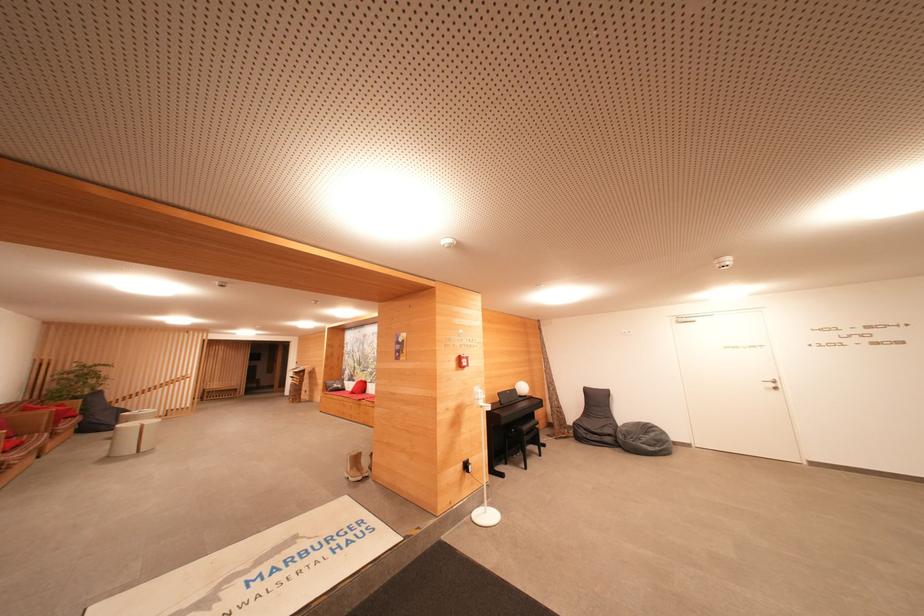
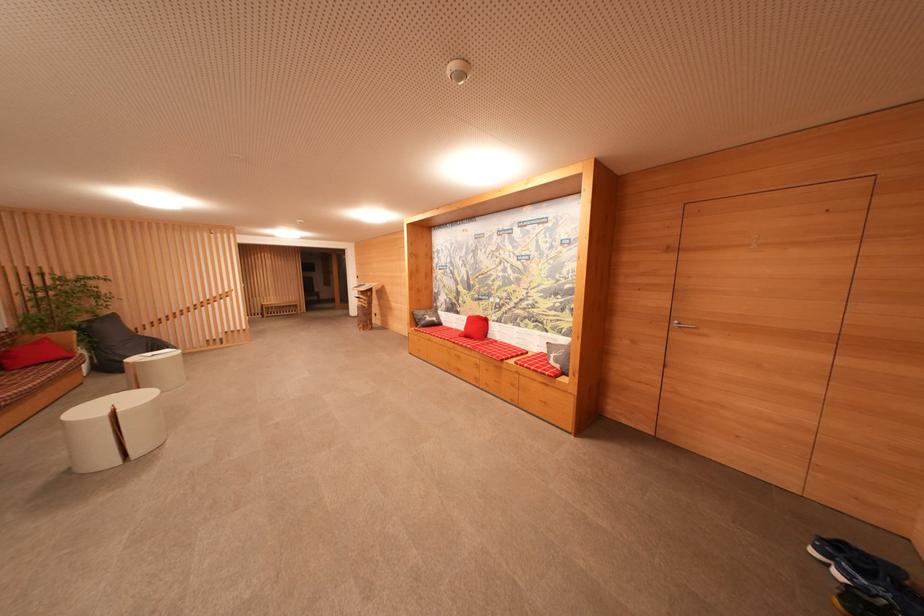
The images are taken continuously from a first-person perspective. In which direction are you moving?

The cameraman walked toward left, forward.